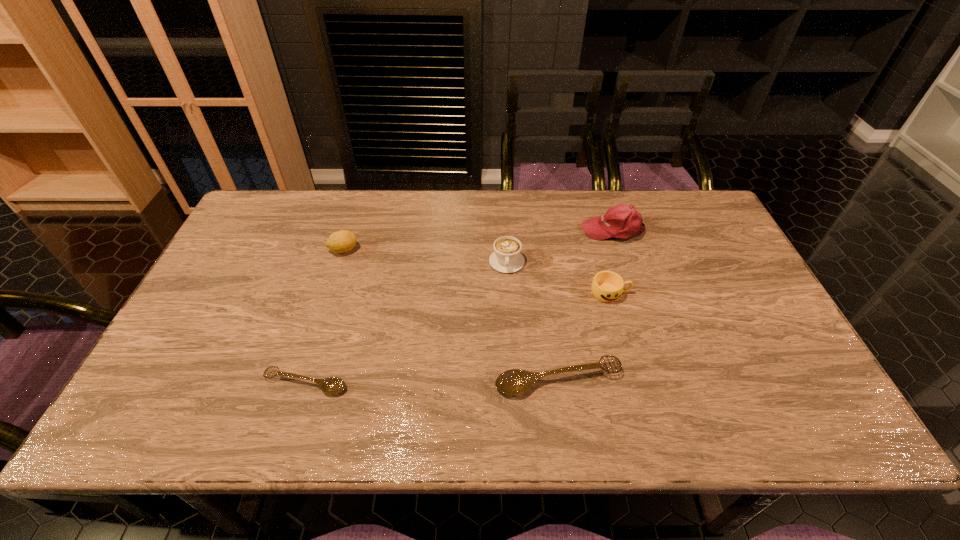
You are a GUI agent. You are given a task and a screenshot of the screen. Output one action in this format:
    pyautogui.click(x=<x>, y=<y>)
    Task: Click on the vacant space that satisfies the following two spatial constraints: 1. on the back side of the right ladle; 2. on the left side of the shortest object
    
    Given the screenshot: What is the action you would take?
    tap(307, 380)

The width and height of the screenshot is (960, 540). In order to click on vacant space that satisfies the following two spatial constraints: 1. at the front of the baseball cap with the brim; 2. to the right of the cappuccino's handle in this screenshot , I will do `click(623, 262)`.

Locate an element on the screen. The height and width of the screenshot is (540, 960). free space that satisfies the following two spatial constraints: 1. on the back side of the taller ladle; 2. at the stem end of the lemon is located at coordinates (540, 250).